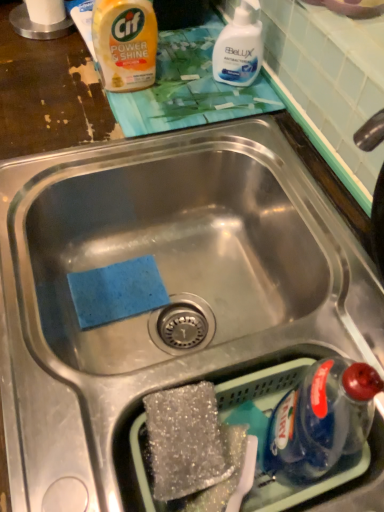
Locate an element on the screen. This screenshot has width=384, height=512. sparkly silver sponge at bottom center is located at coordinates (186, 441).

You are a GUI agent. You are given a task and a screenshot of the screen. Output one action in this format:
    pyautogui.click(x=<x>, y=<y>)
    Task: Click on the yellow plastic bottle at upper left
    The image size is (384, 512).
    Given the screenshot: What is the action you would take?
    pyautogui.click(x=125, y=42)

You are a GUI agent. You are given a task and a screenshot of the screen. Output one action in this format:
    pyautogui.click(x=<x>, y=<y>)
    Task: Click on the blue translucent bottle at lower right
    
    Given the screenshot: What is the action you would take?
    pyautogui.click(x=318, y=422)

What is the approximate width of blue translucent bottle at lower right?

It is 3.42 inches.

This screenshot has width=384, height=512. In order to click on white glossy liquid at upper center in this screenshot , I will do `click(239, 47)`.

I want to click on sparkly silver sponge at bottom center, so click(x=186, y=441).

Does blue translucent bottle at lower right have a smaller size compared to white glossy liquid at upper center?

Incorrect, blue translucent bottle at lower right is not smaller in size than white glossy liquid at upper center.

Is blue translucent bottle at lower right outside of white glossy liquid at upper center?

Yes, blue translucent bottle at lower right is outside of white glossy liquid at upper center.

Which is further, (x=326, y=395) or (x=216, y=65)?

The point (x=216, y=65) is more distant.

Visually, is blue translucent bottle at lower right positioned to the left or to the right of white glossy liquid at upper center?

blue translucent bottle at lower right is positioned on white glossy liquid at upper center's right side.

Choose the correct answer: Is sparkly silver sponge at bottom center inside white glossy liquid at upper center or outside it?

sparkly silver sponge at bottom center is not enclosed by white glossy liquid at upper center.

Consider the image. Is sparkly silver sponge at bottom center thinner than white glossy liquid at upper center?

Correct, the width of sparkly silver sponge at bottom center is less than that of white glossy liquid at upper center.

From a real-world perspective, is sparkly silver sponge at bottom center positioned under white glossy liquid at upper center based on gravity?

Yes, from a real-world perspective, sparkly silver sponge at bottom center is under white glossy liquid at upper center.

Does point (208, 482) come farther from viewer compared to point (234, 65)?

That is False.

Between yellow plastic bottle at upper left and white glossy liquid at upper center, which one is positioned in front?

yellow plastic bottle at upper left.

Considering the relative positions of yellow plastic bottle at upper left and white glossy liquid at upper center in the image provided, is yellow plastic bottle at upper left to the right of white glossy liquid at upper center from the viewer's perspective?

No.

Is yellow plastic bottle at upper left taller than white glossy liquid at upper center?

Yes, yellow plastic bottle at upper left is taller than white glossy liquid at upper center.

Is there a large distance between yellow plastic bottle at upper left and white glossy liquid at upper center?

They are positioned close to each other.

Which of these two, blue translucent bottle at lower right or yellow plastic bottle at upper left, is thinner?

With smaller width is blue translucent bottle at lower right.

Based on their sizes in the image, would you say blue translucent bottle at lower right is bigger or smaller than yellow plastic bottle at upper left?

In the image, blue translucent bottle at lower right appears to be smaller than yellow plastic bottle at upper left.

Is blue translucent bottle at lower right directly adjacent to yellow plastic bottle at upper left?

They are not placed beside each other.

Is yellow plastic bottle at upper left located within blue translucent bottle at lower right?

Actually, yellow plastic bottle at upper left is outside blue translucent bottle at lower right.

Which object is positioned more to the left, white glossy liquid at upper center or yellow plastic bottle at upper left?

From the viewer's perspective, yellow plastic bottle at upper left appears more on the left side.

Does white glossy liquid at upper center turn towards yellow plastic bottle at upper left?

Yes, white glossy liquid at upper center is turned towards yellow plastic bottle at upper left.

From the image's perspective, is white glossy liquid at upper center located above yellow plastic bottle at upper left?

Actually, white glossy liquid at upper center appears below yellow plastic bottle at upper left in the image.

This screenshot has height=512, width=384. Identify the location of cleaning product that is on the right side of yellow plastic bottle at upper left. (239, 47).

Based on the photo, which of these two, yellow plastic bottle at upper left or sparkly silver sponge at bottom center, is wider?

sparkly silver sponge at bottom center.

From the picture: Who is taller, yellow plastic bottle at upper left or sparkly silver sponge at bottom center?

yellow plastic bottle at upper left.

From a real-world perspective, relative to sparkly silver sponge at bottom center, is yellow plastic bottle at upper left vertically above or below?

In terms of real-world spatial position, yellow plastic bottle at upper left is above sparkly silver sponge at bottom center.

Does yellow plastic bottle at upper left touch blue translucent bottle at lower right?

They are not placed beside each other.

Looking at the image, does yellow plastic bottle at upper left seem bigger or smaller compared to blue translucent bottle at lower right?

In the image, yellow plastic bottle at upper left appears to be larger than blue translucent bottle at lower right.

From the image's perspective, which one is positioned lower, yellow plastic bottle at upper left or blue translucent bottle at lower right?

From the image's view, blue translucent bottle at lower right is below.

Looking at this image, from a real-world perspective, which is physically below, yellow plastic bottle at upper left or blue translucent bottle at lower right?

blue translucent bottle at lower right is physically lower.

The height and width of the screenshot is (512, 384). I want to click on cleaning product that is behind the blue translucent bottle at lower right, so click(x=239, y=47).

This screenshot has width=384, height=512. I want to click on food below the white glossy liquid at upper center (from the image's perspective), so pyautogui.click(x=186, y=441).

When comparing their distances from blue translucent bottle at lower right, does white glossy liquid at upper center or yellow plastic bottle at upper left seem further?

yellow plastic bottle at upper left.

Which object lies nearer to the anchor point blue translucent bottle at lower right, yellow plastic bottle at upper left or white glossy liquid at upper center?

Among the two, white glossy liquid at upper center is located nearer to blue translucent bottle at lower right.

Estimate the real-world distances between objects in this image. Which object is further from yellow plastic bottle at upper left, blue translucent bottle at lower right or sparkly silver sponge at bottom center?

Among the two, blue translucent bottle at lower right is located further to yellow plastic bottle at upper left.

Estimate the real-world distances between objects in this image. Which object is closer to blue translucent bottle at lower right, sparkly silver sponge at bottom center or yellow plastic bottle at upper left?

Among the two, sparkly silver sponge at bottom center is located nearer to blue translucent bottle at lower right.

In the scene shown: Considering their positions, is white glossy liquid at upper center positioned further to yellow plastic bottle at upper left than sparkly silver sponge at bottom center?

sparkly silver sponge at bottom center.

Which object lies further to the anchor point yellow plastic bottle at upper left, blue translucent bottle at lower right or white glossy liquid at upper center?

Based on the image, blue translucent bottle at lower right appears to be further to yellow plastic bottle at upper left.

Which object lies further to the anchor point blue translucent bottle at lower right, yellow plastic bottle at upper left or sparkly silver sponge at bottom center?

Among the two, yellow plastic bottle at upper left is located further to blue translucent bottle at lower right.

Looking at the image, which one is located further to sparkly silver sponge at bottom center, white glossy liquid at upper center or yellow plastic bottle at upper left?

white glossy liquid at upper center.

You are a GUI agent. You are given a task and a screenshot of the screen. Output one action in this format:
    pyautogui.click(x=<x>, y=<y>)
    Task: Click on the cleaning product that lies between yellow plastic bottle at upper left and blue translucent bottle at lower right from top to bottom
    
    Given the screenshot: What is the action you would take?
    pyautogui.click(x=239, y=47)

Identify the location of bottle that lies between white glossy liquid at upper center and sparkly silver sponge at bottom center from top to bottom. The width and height of the screenshot is (384, 512). (318, 422).

I want to click on bottle between yellow plastic bottle at upper left and sparkly silver sponge at bottom center from top to bottom, so click(318, 422).

Image resolution: width=384 pixels, height=512 pixels. Find the location of `cleaning product between yellow plastic bottle at upper left and sparkly silver sponge at bottom center from top to bottom`. cleaning product between yellow plastic bottle at upper left and sparkly silver sponge at bottom center from top to bottom is located at coordinates (239, 47).